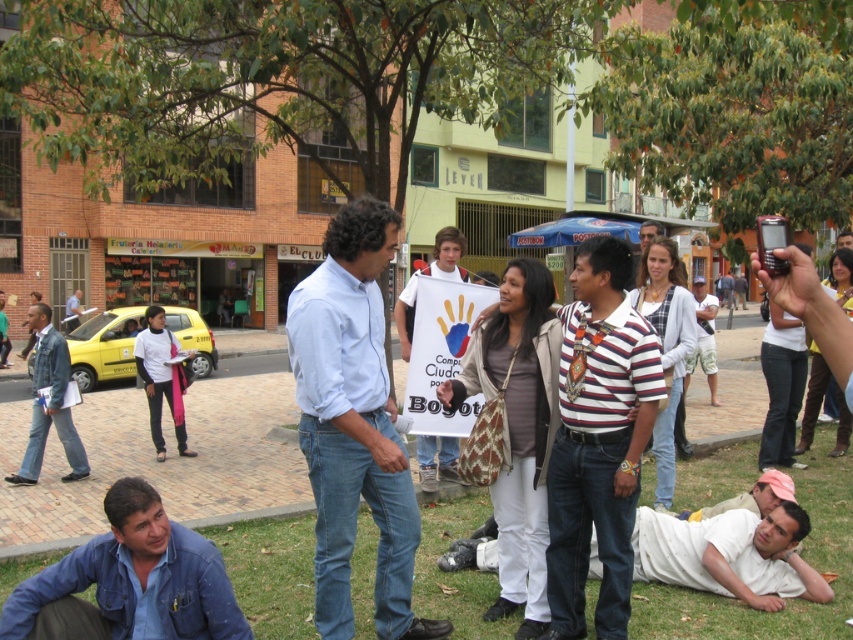
Who is taller, green grass at lower center or blue denim shirt at lower left?

blue denim shirt at lower left is taller.

Which is above, green grass at lower center or blue denim shirt at lower left?

Positioned higher is blue denim shirt at lower left.

Is point (461, 513) more distant than point (76, 609)?

That is True.

Where is `green grass at lower center`? This screenshot has height=640, width=853. green grass at lower center is located at coordinates (788, 600).

From the picture: Which is more to the right, blue denim shirt at lower left or denim jacket at left?

From the viewer's perspective, blue denim shirt at lower left appears more on the right side.

Find the location of a particular element. This screenshot has height=640, width=853. blue denim shirt at lower left is located at coordinates (132, 580).

Which is in front, point (181, 579) or point (56, 337)?

Positioned in front is point (181, 579).

Locate an element on the screen. The height and width of the screenshot is (640, 853). blue denim shirt at lower left is located at coordinates (132, 580).

Which is more to the left, striped cotton shirt at center or blue denim shirt at lower left?

Positioned to the left is blue denim shirt at lower left.

What do you see at coordinates (598, 440) in the screenshot? Image resolution: width=853 pixels, height=640 pixels. I see `striped cotton shirt at center` at bounding box center [598, 440].

Which is in front, point (592, 465) or point (125, 525)?

Point (125, 525) is in front.

You are a GUI agent. You are given a task and a screenshot of the screen. Output one action in this format:
    pyautogui.click(x=<x>, y=<y>)
    Task: Click on the striped cotton shirt at center
    This screenshot has height=640, width=853.
    Given the screenshot: What is the action you would take?
    pyautogui.click(x=598, y=440)